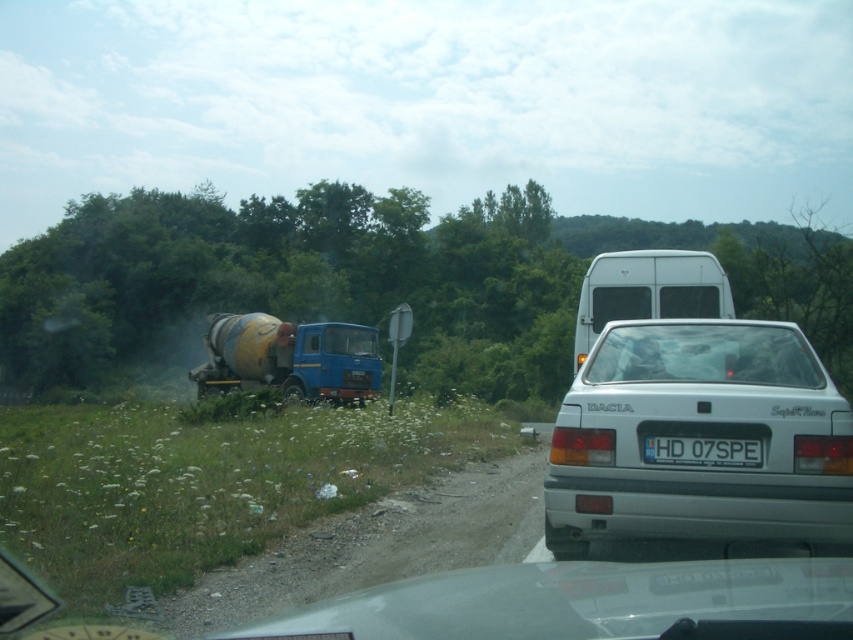
Question: Which point appears farthest from the camera in this image?

Choices:
 (A) (477, 588)
 (B) (329, 584)
 (C) (689, 451)
 (D) (596, 266)

Answer: (D)

Question: Can you confirm if silver metallic car at center is smaller than dirt gravel at lower left?

Choices:
 (A) no
 (B) yes

Answer: (A)

Question: Which object appears farthest from the camera in this image?

Choices:
 (A) blue metallic truck at center-left
 (B) white plastic license plate at center
 (C) dirt gravel at lower left

Answer: (A)

Question: Which object is the farthest from the white plastic license plate at center?

Choices:
 (A) silver metallic car at center
 (B) blue metallic truck at center-left
 (C) white matte van at upper center

Answer: (B)

Question: Does silver metallic car at center lie behind white plastic license plate at center?

Choices:
 (A) yes
 (B) no

Answer: (B)

Question: Is white matte hatchback at center bigger than white matte van at upper center?

Choices:
 (A) yes
 (B) no

Answer: (B)